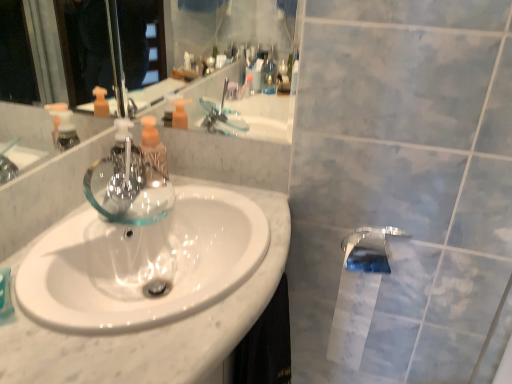
What is the approximate height of white paper at lower right?

white paper at lower right is 16.42 inches in height.

In order to click on white paper at lower right in this screenshot , I will do `click(352, 314)`.

This screenshot has width=512, height=384. Find the location of `white glossy sink at center`. white glossy sink at center is located at coordinates (143, 264).

Where is `polished chrome tap at lower right, positioned as the second tap in top-to-bottom order`? polished chrome tap at lower right, positioned as the second tap in top-to-bottom order is located at coordinates (370, 249).

The image size is (512, 384). Find the location of `transparent glass tap at center, the first tap from the top`. transparent glass tap at center, the first tap from the top is located at coordinates (128, 184).

Does white paper at lower right come in front of white glossy sink at center?

No, it is behind white glossy sink at center.

How different are the orientations of white paper at lower right and white glossy sink at center in degrees?

white paper at lower right and white glossy sink at center are facing 89.9 degrees away from each other.

Could you tell me if white paper at lower right is facing white glossy sink at center?

No, white paper at lower right is not oriented towards white glossy sink at center.

In terms of height, does white paper at lower right look taller or shorter compared to white glossy sink at center?

In the image, white paper at lower right appears to be taller than white glossy sink at center.

In terms of size, does white paper at lower right appear bigger or smaller than translucent plastic soap dispenser at center?

Considering their sizes, white paper at lower right takes up more space than translucent plastic soap dispenser at center.

From the image's perspective, is white paper at lower right on translucent plastic soap dispenser at center?

Result: Incorrect, from the image's perspective, white paper at lower right is lower than translucent plastic soap dispenser at center.

Is white paper at lower right looking in the opposite direction of translucent plastic soap dispenser at center?

No.

Which of these two, white paper at lower right or translucent plastic soap dispenser at center, is wider?

white paper at lower right.

Locate an element on the screen. tap that is on the left side of white glossy sink at center is located at coordinates (128, 184).

Which is behind, white glossy sink at center or transparent glass tap at center, the first tap from the top?

transparent glass tap at center, the first tap from the top, is further from the camera.

Is white glossy sink at center thinner than transparent glass tap at center, which is the first tap in left-to-right order?

In fact, white glossy sink at center might be wider than transparent glass tap at center, which is the first tap in left-to-right order.

Is polished chrome tap at lower right, the first tap viewed from the right, far from transparent glass tap at center, positioned as the second tap in bottom-to-top order?

No, there isn't a large distance between polished chrome tap at lower right, the first tap viewed from the right, and transparent glass tap at center, positioned as the second tap in bottom-to-top order.

Which is farther, (364, 270) or (115, 200)?

Positioned behind is point (364, 270).

Is the depth of polished chrome tap at lower right, acting as the second tap starting from the left, less than that of transparent glass tap at center, the first tap from the top?

No, it is not.

At what (x,y) coordinates should I click in order to perform the action: click on tap in front of the polished chrome tap at lower right, the first tap when ordered from bottom to top. Please return your answer as a coordinate pair (x, y). Looking at the image, I should click on (128, 184).

From the image's perspective, is translucent plastic soap dispenser at center beneath transparent glass tap at center, which is the first tap in left-to-right order?

No.

Considering the positions of objects translucent plastic soap dispenser at center and transparent glass tap at center, the first tap from the top, in the image provided, who is in front, translucent plastic soap dispenser at center or transparent glass tap at center, the first tap from the top,?

transparent glass tap at center, the first tap from the top, is closer to the camera.

Find the location of a particular element. The image size is (512, 384). toiletry behind the transparent glass tap at center, which is the first tap in left-to-right order is located at coordinates (153, 150).

Which is behind, point (147, 117) or point (160, 186)?

The point (147, 117) is more distant.

Which of these two, transparent glass tap at center, acting as the 2th tap starting from the right, or polished chrome tap at lower right, the first tap viewed from the right, stands shorter?

With less height is polished chrome tap at lower right, the first tap viewed from the right.

Is transparent glass tap at center, positioned as the second tap in bottom-to-top order, thinner than polished chrome tap at lower right, positioned as the second tap in top-to-bottom order?

No.

Measure the distance from transparent glass tap at center, the first tap from the top, to polished chrome tap at lower right, acting as the second tap starting from the left.

transparent glass tap at center, the first tap from the top, and polished chrome tap at lower right, acting as the second tap starting from the left, are 55.92 centimeters apart from each other.

The height and width of the screenshot is (384, 512). What are the coordinates of `tap lying above the polished chrome tap at lower right, positioned as the second tap in top-to-bottom order (from the image's perspective)` in the screenshot? It's located at (128, 184).

Which is in front, point (138, 173) or point (356, 317)?

The point (138, 173) is in front.

From the image's perspective, is transparent glass tap at center, the first tap from the top, located above or below white paper at lower right?

transparent glass tap at center, the first tap from the top, is above white paper at lower right.

From a real-world perspective, which object rests below the other?

In real-world perspective, white paper at lower right is lower.

Could you tell me if transparent glass tap at center, positioned as the second tap in bottom-to-top order, is facing white paper at lower right?

No.

You are a GUI agent. You are given a task and a screenshot of the screen. Output one action in this format:
    pyautogui.click(x=<x>, y=<y>)
    Task: Click on the sink that is above the white paper at lower right (from a real-world perspective)
    This screenshot has height=384, width=512.
    Given the screenshot: What is the action you would take?
    pos(143,264)

Locate an element on the screen. toilet paper located below the translucent plastic soap dispenser at center (from the image's perspective) is located at coordinates (352, 314).

Estimate the real-world distances between objects in this image. Which object is further from white paper at lower right, white glossy sink at center or transparent glass tap at center, acting as the 2th tap starting from the right?

transparent glass tap at center, acting as the 2th tap starting from the right, is further to white paper at lower right.

Which object lies nearer to the anchor point white glossy sink at center, white paper at lower right or translucent plastic soap dispenser at center?

translucent plastic soap dispenser at center.

Estimate the real-world distances between objects in this image. Which object is further from white paper at lower right, translucent plastic soap dispenser at center or polished chrome tap at lower right, positioned as the second tap in top-to-bottom order?

translucent plastic soap dispenser at center is further to white paper at lower right.

Considering their positions, is translucent plastic soap dispenser at center positioned further to white paper at lower right than transparent glass tap at center, acting as the 2th tap starting from the right?

translucent plastic soap dispenser at center.

Considering their positions, is white paper at lower right positioned closer to transparent glass tap at center, acting as the 2th tap starting from the right, than polished chrome tap at lower right, the first tap when ordered from bottom to top?

Based on the image, polished chrome tap at lower right, the first tap when ordered from bottom to top, appears to be nearer to transparent glass tap at center, acting as the 2th tap starting from the right.

From the image, which object appears to be nearer to white glossy sink at center, polished chrome tap at lower right, the first tap viewed from the right, or translucent plastic soap dispenser at center?

Among the two, translucent plastic soap dispenser at center is located nearer to white glossy sink at center.

Consider the image. Looking at the image, which one is located further to polished chrome tap at lower right, acting as the second tap starting from the left, transparent glass tap at center, positioned as the second tap in bottom-to-top order, or translucent plastic soap dispenser at center?

transparent glass tap at center, positioned as the second tap in bottom-to-top order.

Consider the image. Looking at the image, which one is located further to white paper at lower right, transparent glass tap at center, positioned as the second tap in bottom-to-top order, or polished chrome tap at lower right, the first tap viewed from the right?

transparent glass tap at center, positioned as the second tap in bottom-to-top order, is positioned further to the anchor white paper at lower right.

Locate an element on the screen. The image size is (512, 384). toilet paper located between white glossy sink at center and polished chrome tap at lower right, the first tap viewed from the right, in the left-right direction is located at coordinates (x=352, y=314).

Where is `toiletry located between transparent glass tap at center, acting as the 2th tap starting from the right, and white paper at lower right in the left-right direction`? The image size is (512, 384). toiletry located between transparent glass tap at center, acting as the 2th tap starting from the right, and white paper at lower right in the left-right direction is located at coordinates (153, 150).

This screenshot has height=384, width=512. I want to click on toiletry between transparent glass tap at center, which is the first tap in left-to-right order, and polished chrome tap at lower right, the first tap viewed from the right, so click(153, 150).

Where is `toilet paper between translucent plastic soap dispenser at center and polished chrome tap at lower right, the first tap when ordered from bottom to top`? The height and width of the screenshot is (384, 512). toilet paper between translucent plastic soap dispenser at center and polished chrome tap at lower right, the first tap when ordered from bottom to top is located at coordinates (352, 314).